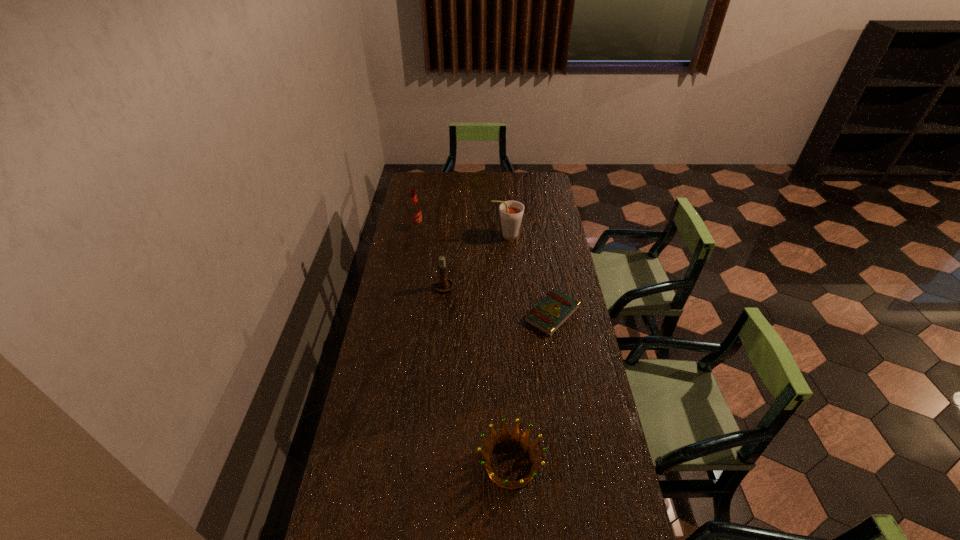
The image size is (960, 540). I want to click on unoccupied position between the shortest object and the leftmost object, so click(x=485, y=271).

Locate an element on the screen. free point between the shortest object and the fourth tallest object is located at coordinates (531, 389).

Where is `vacant area between the book and the fourth tallest object`? vacant area between the book and the fourth tallest object is located at coordinates (531, 389).

Identify the location of object that is the third nearest to the crown. (511, 212).

This screenshot has height=540, width=960. In order to click on the closest object relative to the leftmost object in this screenshot , I will do `click(511, 212)`.

At what (x,y) coordinates should I click in order to perform the action: click on vacant area in the image that satisfies the following two spatial constraints: 1. on the back side of the shortest object; 2. on the drink side of the right root beer. Please return your answer as a coordinate pair (x, y). The image size is (960, 540). Looking at the image, I should click on (540, 236).

Image resolution: width=960 pixels, height=540 pixels. In order to click on free space that satisfies the following two spatial constraints: 1. on the drink side of the right root beer; 2. on the right side of the book in this screenshot , I will do `click(512, 314)`.

The width and height of the screenshot is (960, 540). What are the coordinates of `free space that satisfies the following two spatial constraints: 1. on the drink side of the book; 2. on the right side of the right root beer` in the screenshot? It's located at (512, 314).

Where is `free space that satisfies the following two spatial constraints: 1. on the drink side of the right root beer; 2. on the front side of the nearest object`? This screenshot has height=540, width=960. free space that satisfies the following two spatial constraints: 1. on the drink side of the right root beer; 2. on the front side of the nearest object is located at coordinates (523, 464).

Find the location of a particular element. free spot that satisfies the following two spatial constraints: 1. on the back side of the shortest object; 2. on the drink side of the right root beer is located at coordinates (540, 236).